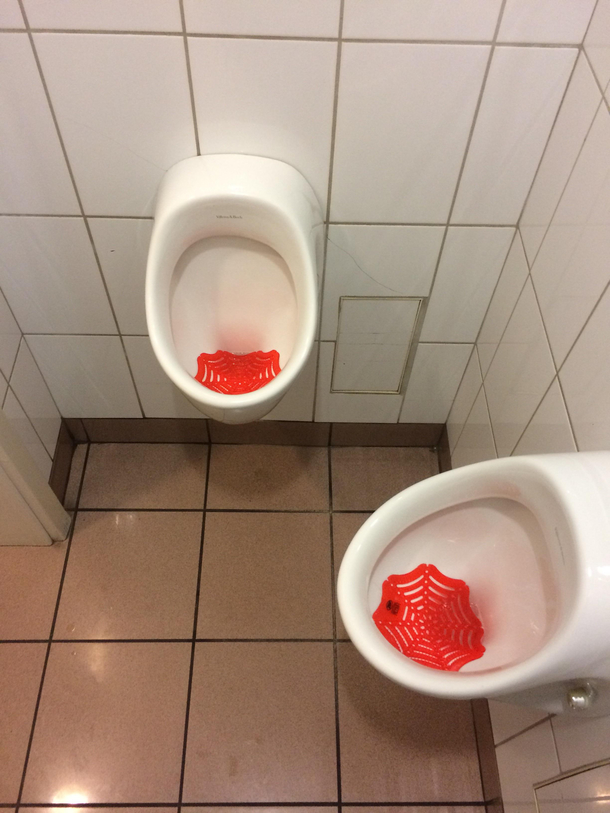
Identify the location of door frame. This screenshot has height=813, width=610. (29, 480), (16, 528).